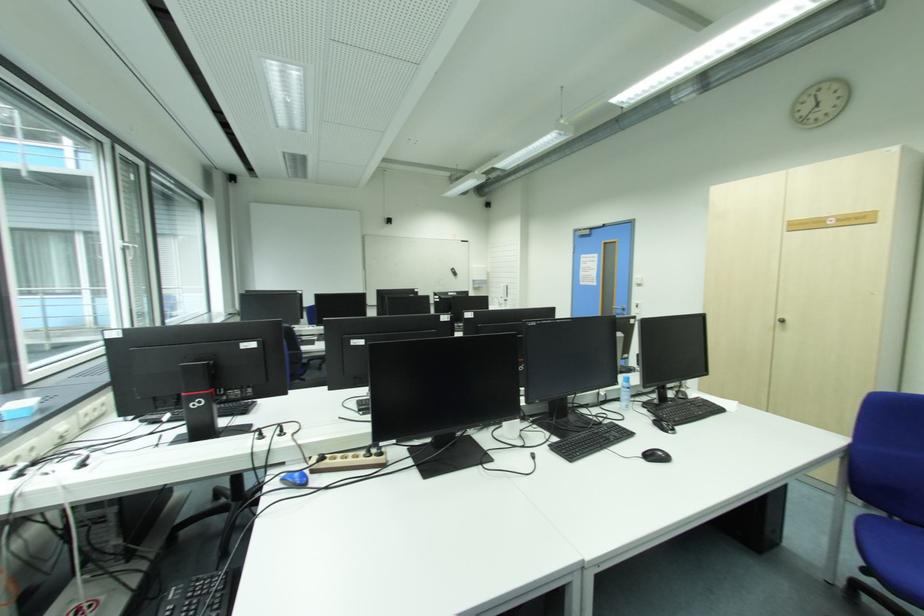
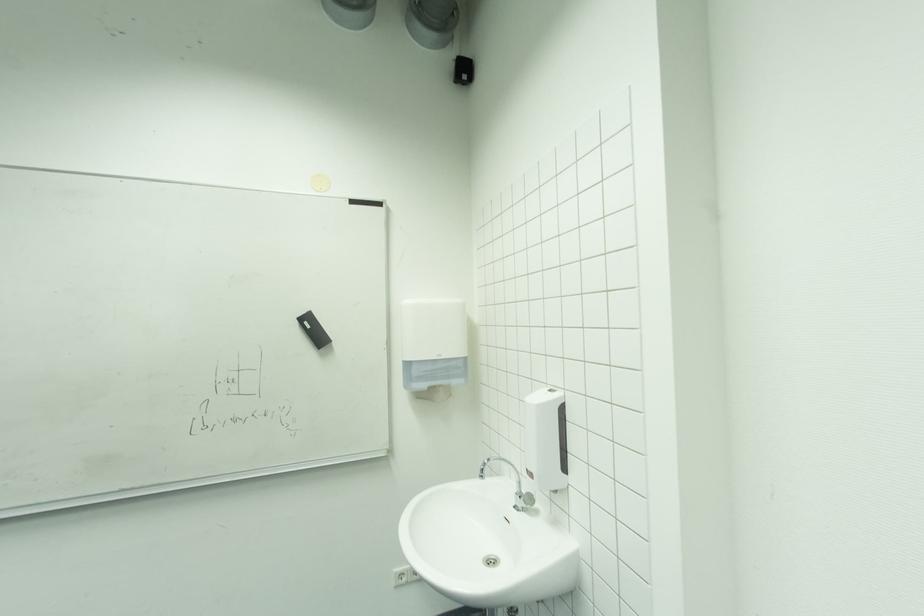
Locate, in the second image, the point that corresponds to point (506, 305) in the first image.

(536, 501)